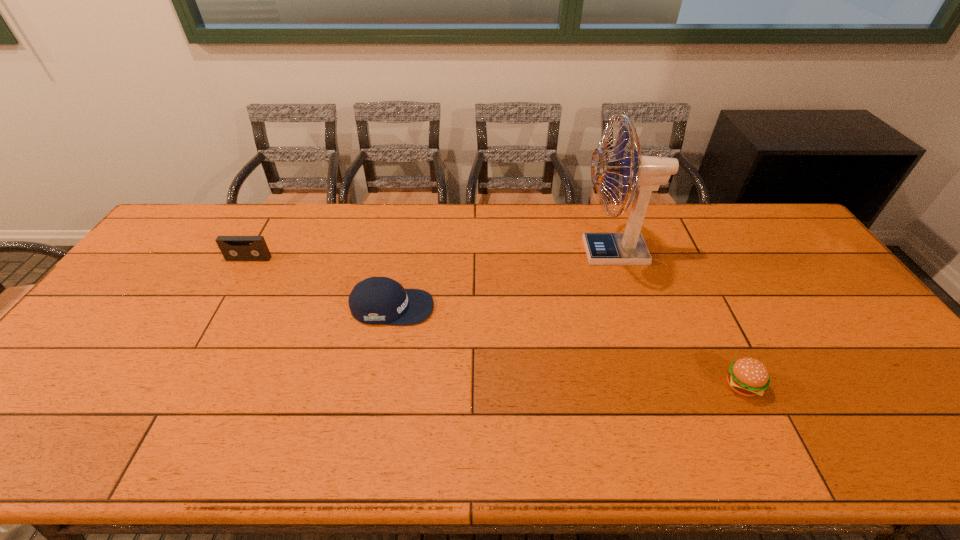
What are the coordinates of `free location located 0.200m on the front-facing side of the second object from left to right` in the screenshot? It's located at (504, 307).

The height and width of the screenshot is (540, 960). What are the coordinates of `free region located 0.120m on the front-facing side of the videotape` in the screenshot? It's located at (232, 288).

The image size is (960, 540). Identify the location of vacant space positioned 0.240m on the back of the rightmost object. (700, 300).

You are a GUI agent. You are given a task and a screenshot of the screen. Output one action in this format:
    pyautogui.click(x=<x>, y=<y>)
    Task: Click on the object present at the far edge
    The height and width of the screenshot is (540, 960).
    Given the screenshot: What is the action you would take?
    pyautogui.click(x=647, y=173)

Identify the location of vacant space at the far edge. (546, 232).

Locate an element on the screen. Image resolution: width=960 pixels, height=540 pixels. free space at the near edge of the desktop is located at coordinates (811, 456).

In the image, there is a desktop. Where is `free space at the left edge`? This screenshot has width=960, height=540. free space at the left edge is located at coordinates (164, 275).

In the image, there is a desktop. Where is `free space at the far left corner`? free space at the far left corner is located at coordinates (207, 219).

Identify the location of free space between the second nearest object and the nearest object. The image size is (960, 540). (566, 347).

I want to click on free point between the fan and the leftmost object, so click(431, 255).